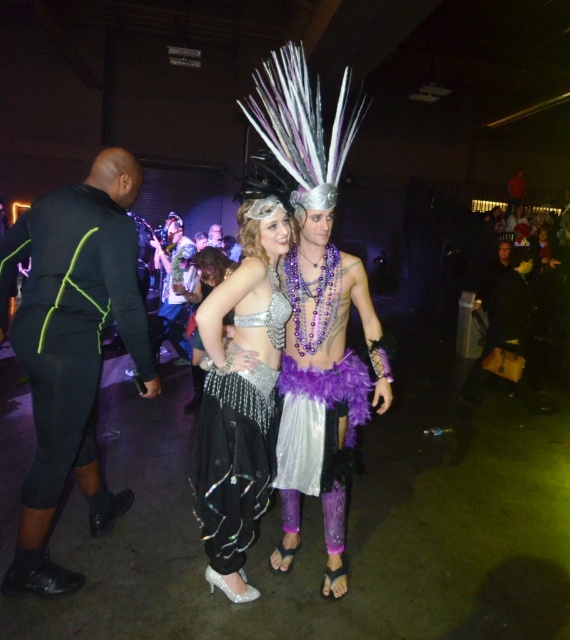
You are a photographer trying to capture a group photo of the black neoprene pants at left and the sparkly silver dress at center. The camera you are using has a minimum focus distance of 5 feet. Can you take a photo of both subjects without moving them?

The black neoprene pants at left and the sparkly silver dress at center are 5.57 feet apart from each other. Since the minimum focus distance is 5 feet, the camera can focus on both subjects as they are within the required distance.

Based on the provided scene description, what object is located at the coordinates point (206, 273)?

The point (206, 273) marks the location of the sparkly silver dress at center.

You are at the costume party and want to take a photo of both the point at coordinates point (x=124, y=179) and point (x=197, y=355). Which point should you focus on first to ensure both are in focus?

You should focus on point (x=124, y=179) first because it is closer to the camera than point (x=197, y=355). This ensures the closer point is in focus, and the farther point will also be within the depth of field.